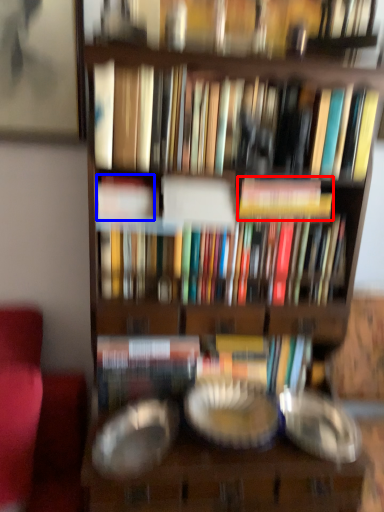
Question: Which point is closer to the camera, book (highlighted by a red box) or book (highlighted by a blue box)?

Choices:
 (A) book
 (B) book

Answer: (B)